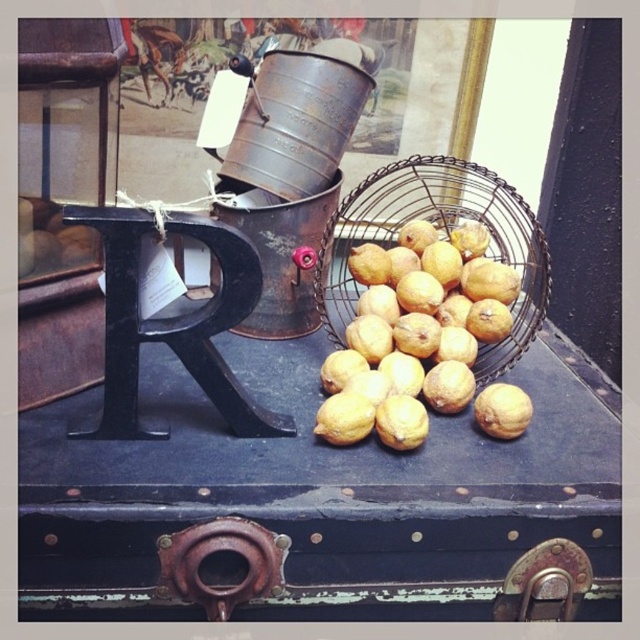
Is rusty metal trunk at center shorter than yellow matte lemon at center?

Incorrect, rusty metal trunk at center's height does not fall short of yellow matte lemon at center's.

Between point (204, 484) and point (500, 436), which one is positioned in front?

Point (204, 484) is more forward.

This screenshot has height=640, width=640. Find the location of `rusty metal trunk at center`. rusty metal trunk at center is located at coordinates (320, 497).

Between rusty metal trunk at center and metallic wire basket at center, which one appears on the right side from the viewer's perspective?

From the viewer's perspective, metallic wire basket at center appears more on the right side.

Where is `rusty metal trunk at center`? The width and height of the screenshot is (640, 640). rusty metal trunk at center is located at coordinates coord(320,497).

Identify the location of rusty metal trunk at center. (320, 497).

Does metallic wire basket at center have a greater width compared to yellow matte lemon at center?

Correct, the width of metallic wire basket at center exceeds that of yellow matte lemon at center.

Locate an element on the screen. This screenshot has width=640, height=640. metallic wire basket at center is located at coordinates (440, 237).

Identify the location of metallic wire basket at center. (440, 237).